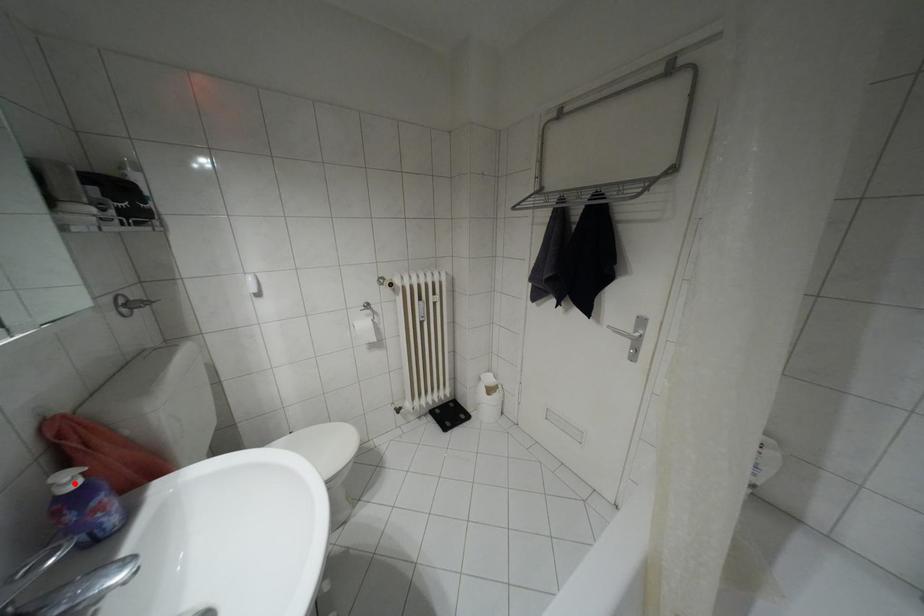
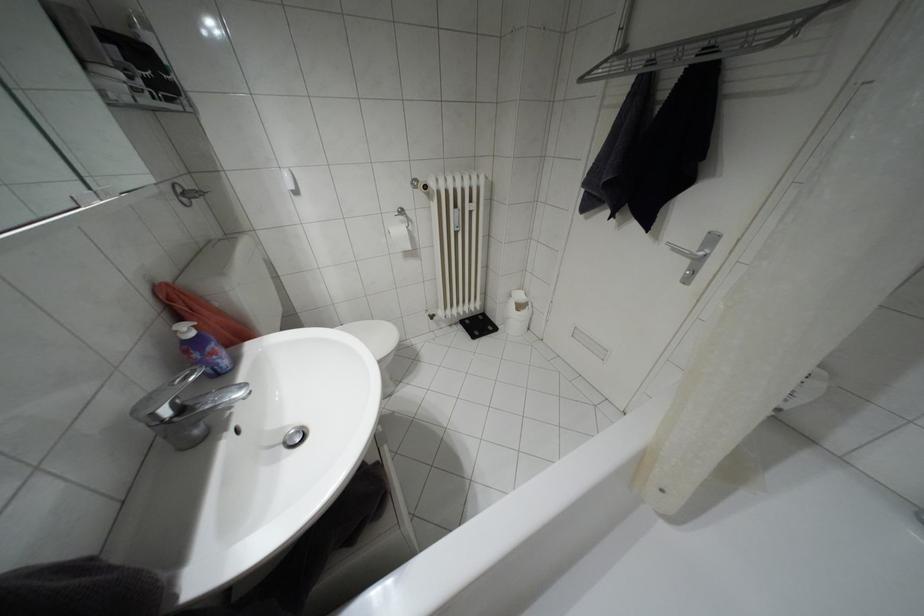
Locate, in the second image, the point that corresponds to the highlighted location in the first image.

(190, 333)